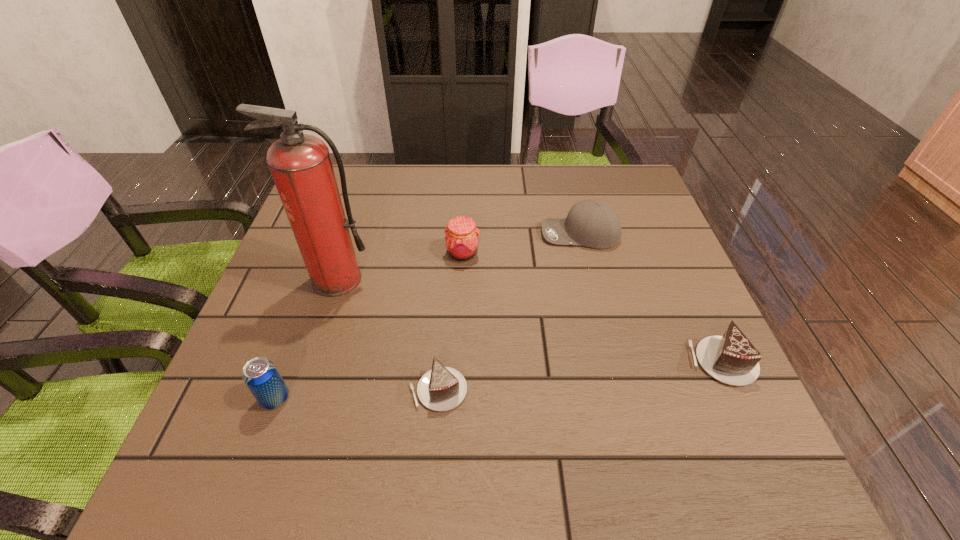
This screenshot has height=540, width=960. I want to click on baseball cap at the right edge, so [590, 223].

Find the location of a particular element. This screenshot has width=960, height=540. object located at the near left corner is located at coordinates [261, 376].

Where is `object that is positioned at the near right corner`? This screenshot has height=540, width=960. object that is positioned at the near right corner is located at coordinates (732, 359).

In the image, there is a desktop. Where is `vacant space at the far edge`? This screenshot has width=960, height=540. vacant space at the far edge is located at coordinates (526, 165).

At what (x,y) coordinates should I click in order to perform the action: click on vacant point at the left edge. Please return your answer as a coordinate pair (x, y). This screenshot has height=540, width=960. Looking at the image, I should click on (275, 305).

Identify the location of vacant space at the near left corner. The image size is (960, 540). (291, 410).

The width and height of the screenshot is (960, 540). In the image, there is a desktop. What are the coordinates of `vacant space at the far right corner` in the screenshot? It's located at coord(599,171).

Where is `blank area at the near right corner`? blank area at the near right corner is located at coordinates (699, 417).

Identify the location of vacant point located between the beer can and the jam. Image resolution: width=960 pixels, height=540 pixels. (369, 326).

I want to click on vacant area that lies between the shorter chocolate cake and the right chocolate cake, so click(x=581, y=376).